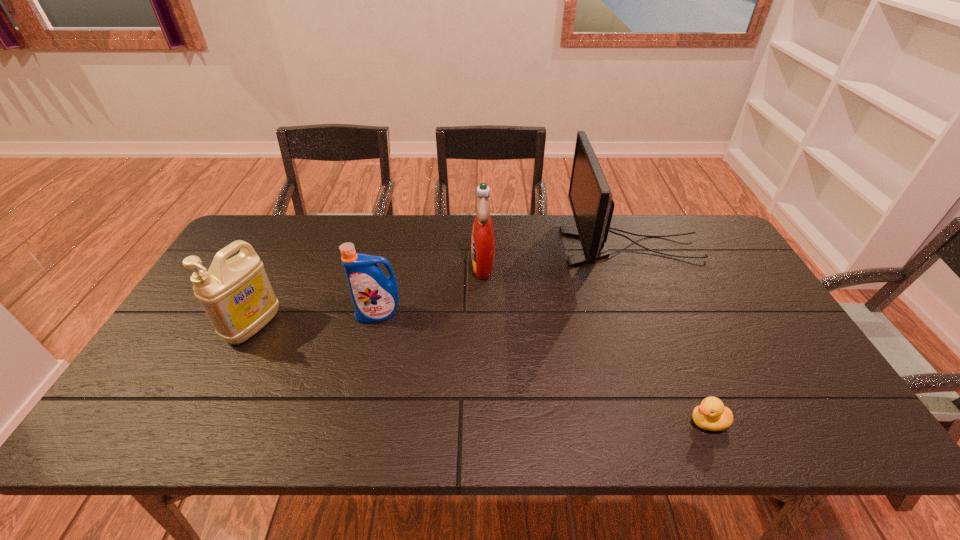
This screenshot has height=540, width=960. In order to click on object present at the near edge in this screenshot , I will do `click(711, 415)`.

Where is `object that is at the left edge`? object that is at the left edge is located at coordinates (236, 294).

The height and width of the screenshot is (540, 960). In order to click on object at the right edge in this screenshot , I will do `click(590, 197)`.

This screenshot has height=540, width=960. Identify the location of object that is at the far right corner. (590, 197).

What are the coordinates of `vacant area at the far edge` in the screenshot? It's located at point(466,231).

Identify the location of vacant space at the near edge. This screenshot has width=960, height=540. (251, 421).

Identify the location of free location at the left edge of the desktop. (178, 340).

In the image, there is a desktop. Where is `free space at the right edge`? The width and height of the screenshot is (960, 540). free space at the right edge is located at coordinates (797, 361).

In order to click on free space at the far left corner in this screenshot , I will do `click(273, 244)`.

You are a GUI agent. You are given a task and a screenshot of the screen. Output one action in this format:
    pyautogui.click(x=<x>, y=<y>)
    Task: Click on the free location at the far right corner of the desktop
    Image resolution: width=960 pixels, height=540 pixels.
    Given the screenshot: What is the action you would take?
    pyautogui.click(x=692, y=249)